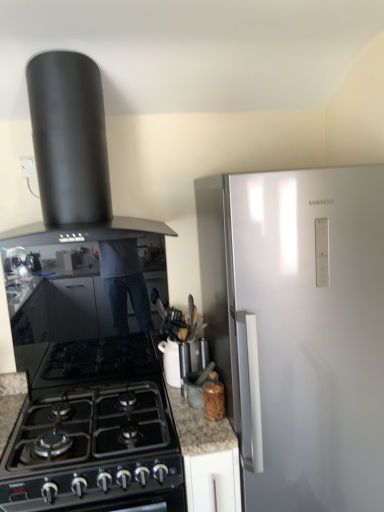
Question: Is white glossy teapot at center, the 2th kitchen appliance in the right-to-left sequence, not inside brown glass bottle at lower center, acting as the 3th kitchen appliance starting from the top?

Choices:
 (A) yes
 (B) no

Answer: (A)

Question: Considering the relative sizes of white glossy teapot at center, the second kitchen appliance viewed from the top, and brown glass bottle at lower center, placed as the first kitchen appliance when sorted from right to left, in the image provided, is white glossy teapot at center, the second kitchen appliance viewed from the top, wider than brown glass bottle at lower center, placed as the first kitchen appliance when sorted from right to left,?

Choices:
 (A) yes
 (B) no

Answer: (A)

Question: Does white glossy teapot at center, the 2th kitchen appliance in the right-to-left sequence, have a lesser height compared to brown glass bottle at lower center, placed as the first kitchen appliance when sorted from right to left?

Choices:
 (A) yes
 (B) no

Answer: (B)

Question: From a real-world perspective, is white glossy teapot at center, arranged as the second kitchen appliance when ordered from the bottom, beneath brown glass bottle at lower center, placed as the first kitchen appliance when sorted from right to left?

Choices:
 (A) yes
 (B) no

Answer: (B)

Question: Can you confirm if white glossy teapot at center, which ranks as the 2th kitchen appliance in left-to-right order, is thinner than brown glass bottle at lower center, acting as the 3th kitchen appliance starting from the top?

Choices:
 (A) yes
 (B) no

Answer: (B)

Question: From the image's perspective, is black matte chimney hood at upper left, marked as the 3th kitchen appliance in a bottom-to-top arrangement, above or below brown glass bottle at lower center, which is counted as the third kitchen appliance, starting from the left?

Choices:
 (A) below
 (B) above

Answer: (B)

Question: Looking at their shapes, would you say black matte chimney hood at upper left, positioned as the first kitchen appliance in left-to-right order, is wider or thinner than brown glass bottle at lower center, placed as the first kitchen appliance when sorted from right to left?

Choices:
 (A) thin
 (B) wide

Answer: (B)

Question: In terms of height, does black matte chimney hood at upper left, marked as the 3th kitchen appliance in a right-to-left arrangement, look taller or shorter compared to brown glass bottle at lower center, placed as the first kitchen appliance when sorted from right to left?

Choices:
 (A) short
 (B) tall

Answer: (B)

Question: Is black matte chimney hood at upper left, marked as the 3th kitchen appliance in a right-to-left arrangement, inside or outside of brown glass bottle at lower center, placed as the first kitchen appliance when sorted from right to left?

Choices:
 (A) outside
 (B) inside

Answer: (A)

Question: Is white glossy teapot at center, the 2th kitchen appliance in the right-to-left sequence, bigger or smaller than black matte chimney hood at upper left, marked as the 3th kitchen appliance in a right-to-left arrangement?

Choices:
 (A) big
 (B) small

Answer: (B)

Question: From a real-world perspective, is white glossy teapot at center, arranged as the second kitchen appliance when ordered from the bottom, above or below black matte chimney hood at upper left, marked as the 3th kitchen appliance in a bottom-to-top arrangement?

Choices:
 (A) above
 (B) below

Answer: (B)

Question: Visually, is white glossy teapot at center, the second kitchen appliance viewed from the top, positioned to the left or to the right of black matte chimney hood at upper left, arranged as the 1th kitchen appliance when viewed from the top?

Choices:
 (A) right
 (B) left

Answer: (A)

Question: From the image's perspective, is white glossy teapot at center, which ranks as the 2th kitchen appliance in left-to-right order, positioned above or below black matte chimney hood at upper left, marked as the 3th kitchen appliance in a right-to-left arrangement?

Choices:
 (A) below
 (B) above

Answer: (A)

Question: In terms of height, does black glass gas stove at lower left look taller or shorter compared to white glossy teapot at center, the second kitchen appliance viewed from the top?

Choices:
 (A) tall
 (B) short

Answer: (B)

Question: Relative to white glossy teapot at center, arranged as the second kitchen appliance when ordered from the bottom, is black glass gas stove at lower left in front or behind?

Choices:
 (A) behind
 (B) front

Answer: (B)